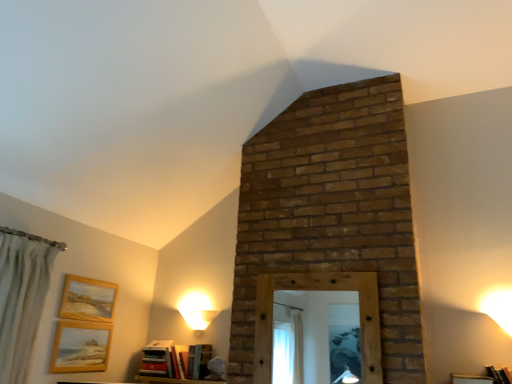
Question: From a real-world perspective, is wooden frame at lower right, acting as the 2th furniture starting from the left, physically located above or below wooden mirror at center?

Choices:
 (A) above
 (B) below

Answer: (B)

Question: Based on their positions, is wooden frame at lower right, acting as the second furniture starting from the bottom, located to the left or right of wooden mirror at center?

Choices:
 (A) right
 (B) left

Answer: (A)

Question: Estimate the real-world distances between objects in this image. Which object is closer to the wooden mirror at center?

Choices:
 (A) wooden picture frame at lower left, the 1th picture frame from the bottom
 (B) white glossy table lamp at lower left
 (C) wooden bookshelf at lower center, the first furniture positioned from the bottom
 (D) matte red book at lower left, which ranks as the 1th book in left-to-right order
 (E) hardcover book at center, which ranks as the 3th book in left-to-right order

Answer: (E)

Question: Estimate the real-world distances between objects in this image. Which object is closer to the matte red book at lower left, which is the 3th book in right-to-left order?

Choices:
 (A) hardcover book at center, acting as the first book starting from the right
 (B) hardcover books at lower center, acting as the second book starting from the left
 (C) wooden frame at lower right, marked as the 1th furniture in a right-to-left arrangement
 (D) wooden mirror at center
 (E) wooden picture frame at lower left, the 1th picture frame from the bottom

Answer: (B)